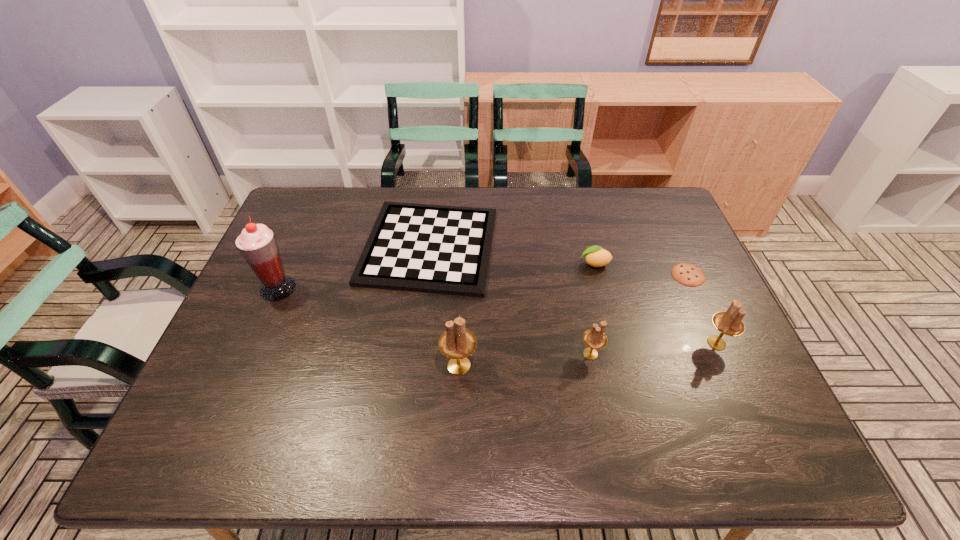
Find the location of a particular element. This screenshot has width=960, height=540. object that is at the left edge is located at coordinates (257, 244).

Locate an element on the screen. The image size is (960, 540). candle holder that is positioned at the right edge is located at coordinates (730, 323).

At what (x,y) coordinates should I click in order to perform the action: click on cookie present at the right edge. Please return your answer as a coordinate pair (x, y). This screenshot has width=960, height=540. Looking at the image, I should click on (687, 274).

Find the location of a particular element. The height and width of the screenshot is (540, 960). free space at the far edge of the desktop is located at coordinates (383, 195).

Find the location of a particular element. free space at the near edge of the desktop is located at coordinates (554, 390).

The image size is (960, 540). Find the location of `vacant area at the left edge`. vacant area at the left edge is located at coordinates (218, 362).

You are a GUI agent. You are given a task and a screenshot of the screen. Output one action in this format:
    pyautogui.click(x=<x>, y=<y>)
    Task: Click on the free space at the right edge of the desktop
    The image size is (960, 540).
    Given the screenshot: What is the action you would take?
    pyautogui.click(x=682, y=234)

Identify the location of vacant area at the near right corner of the desktop. This screenshot has height=540, width=960. point(749,390).

Identify the location of free space between the second candle holder from right to left and the shortest object. (639, 314).

Image resolution: width=960 pixels, height=540 pixels. In order to click on free point between the second candle holder from right to left and the sixth tallest object in this screenshot , I will do `click(510, 300)`.